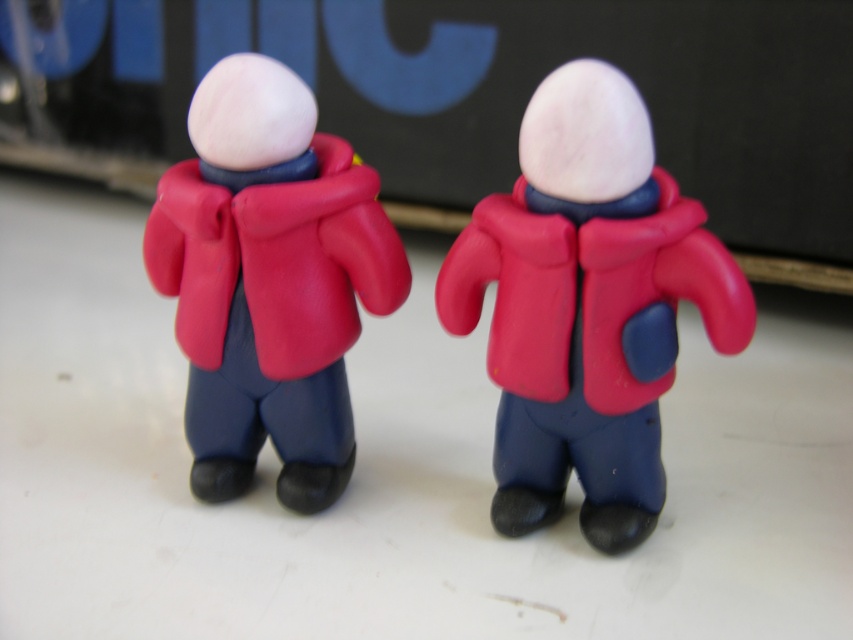
Question: Does rubberized matte red jacket at center appear on the right side of rubberized matte red coat at center?

Choices:
 (A) yes
 (B) no

Answer: (A)

Question: Does rubberized matte red jacket at center have a larger size compared to rubberized matte red coat at center?

Choices:
 (A) yes
 (B) no

Answer: (A)

Question: Can you confirm if rubberized matte red jacket at center is wider than rubberized matte red coat at center?

Choices:
 (A) yes
 (B) no

Answer: (A)

Question: Among these objects, which one is farthest from the camera?

Choices:
 (A) rubberized matte red jacket at center
 (B) rubberized matte red coat at center

Answer: (B)

Question: Which point is closer to the camera?

Choices:
 (A) rubberized matte red coat at center
 (B) rubberized matte red jacket at center

Answer: (B)